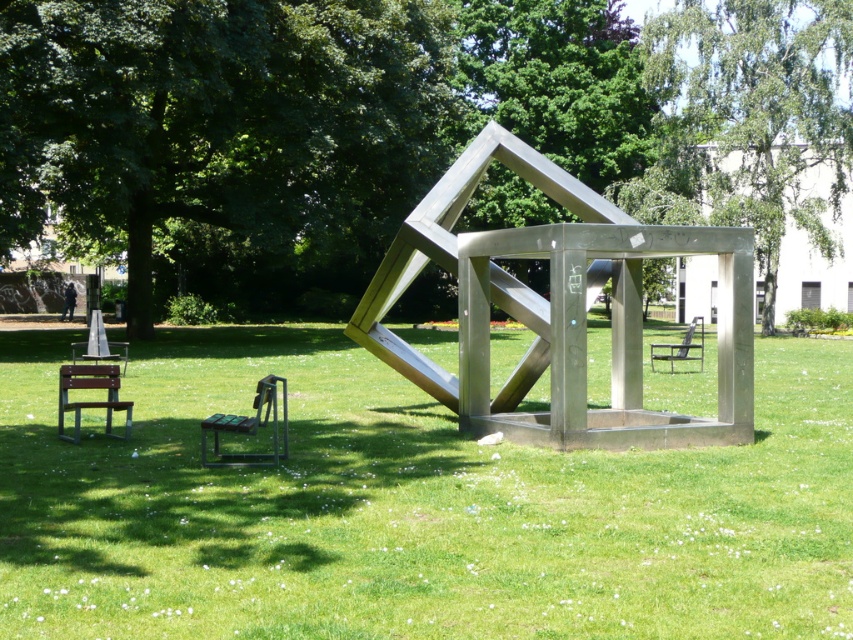
What do you see at coordinates (219, 125) in the screenshot? I see `green leafy tree at upper center` at bounding box center [219, 125].

Is green leafy tree at upper center further to the viewer compared to metallic silver chair at center?

That is True.

Does point (97, 132) come farther from viewer compared to point (651, 348)?

That is True.

Find the location of a particular element. This screenshot has width=853, height=640. green leafy tree at upper center is located at coordinates (219, 125).

Identify the location of polished silver cube at center. The image size is (853, 640). (556, 310).

Is polished silver cube at center wider than wooden park bench at lower left?

Incorrect, polished silver cube at center's width does not surpass wooden park bench at lower left's.

Is point (585, 193) less distant than point (100, 369)?

That is False.

Find the location of `polished silver cube at center`. polished silver cube at center is located at coordinates (556, 310).

Between green leafy tree at upper center and green leafy tree at upper right, which one is positioned higher?

green leafy tree at upper right

Which is behind, point (155, 38) or point (776, 221)?

Positioned behind is point (776, 221).

What are the coordinates of `green leafy tree at upper center` in the screenshot? It's located at (219, 125).